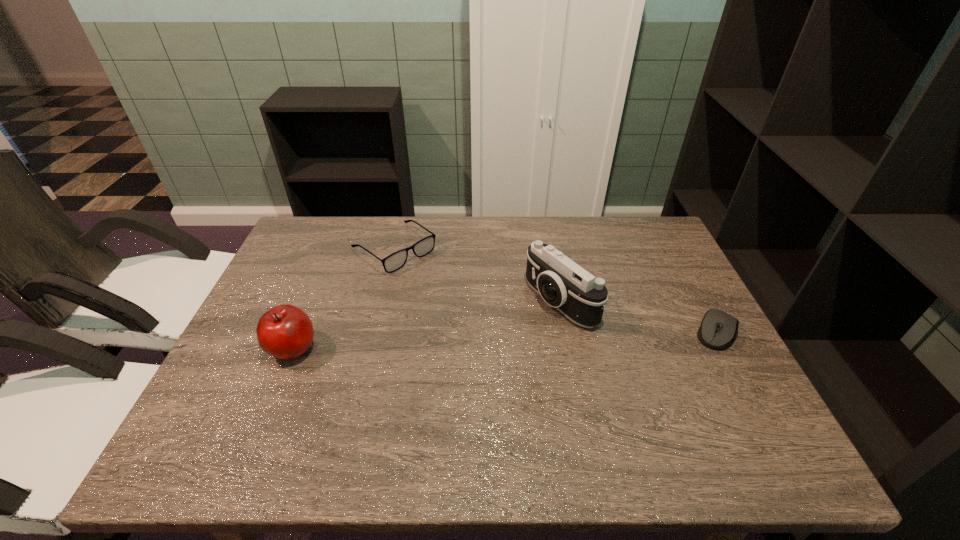
Identify the location of vacant space on the desktop that is between the second tallest object and the rightmost object and is positioned on the front lens of the camera. (490, 341).

Find the location of `free spot on the desktop that is between the third shortest object and the rightmost object and is positioned on the front-facing side of the spectacles`. free spot on the desktop that is between the third shortest object and the rightmost object and is positioned on the front-facing side of the spectacles is located at coordinates (513, 340).